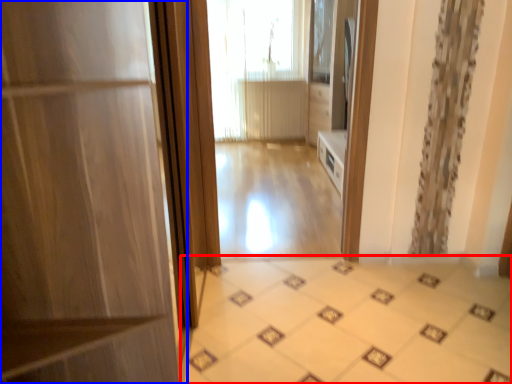
Question: Which of the following is the closest to the observer, ceramic tile (highlighted by a red box) or door (highlighted by a blue box)?

Choices:
 (A) ceramic tile
 (B) door

Answer: (B)